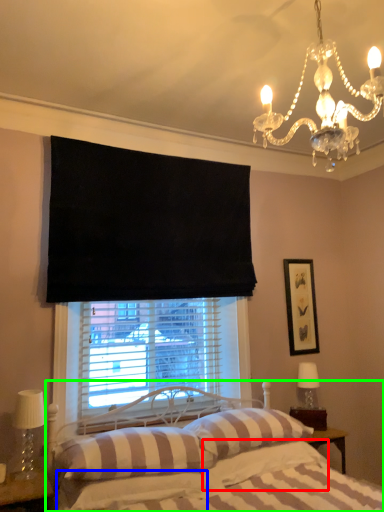
Question: Which is farther away from pillow (highlighted by a red box)? sheet (highlighted by a blue box) or bed (highlighted by a green box)?

Choices:
 (A) sheet
 (B) bed

Answer: (A)